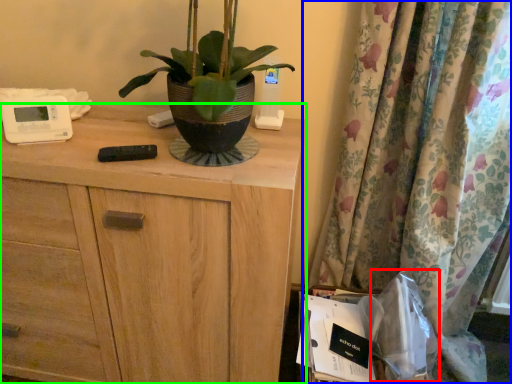
Question: Considering the real-world distances, which object is farthest from paper bag (highlighted by a red box)? curtain (highlighted by a blue box) or chest of drawers (highlighted by a green box)?

Choices:
 (A) curtain
 (B) chest of drawers

Answer: (B)